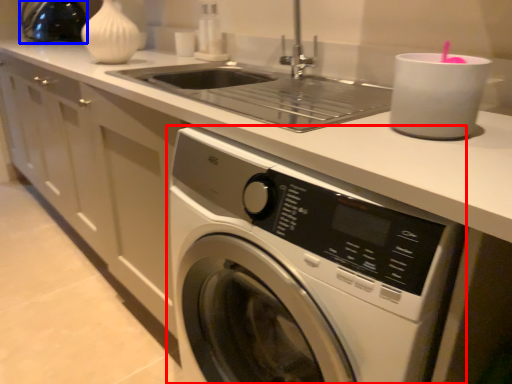
Question: Which object appears closest to the camera in this image, washing machine (highlighted by a red box) or appliance (highlighted by a blue box)?

Choices:
 (A) washing machine
 (B) appliance

Answer: (A)